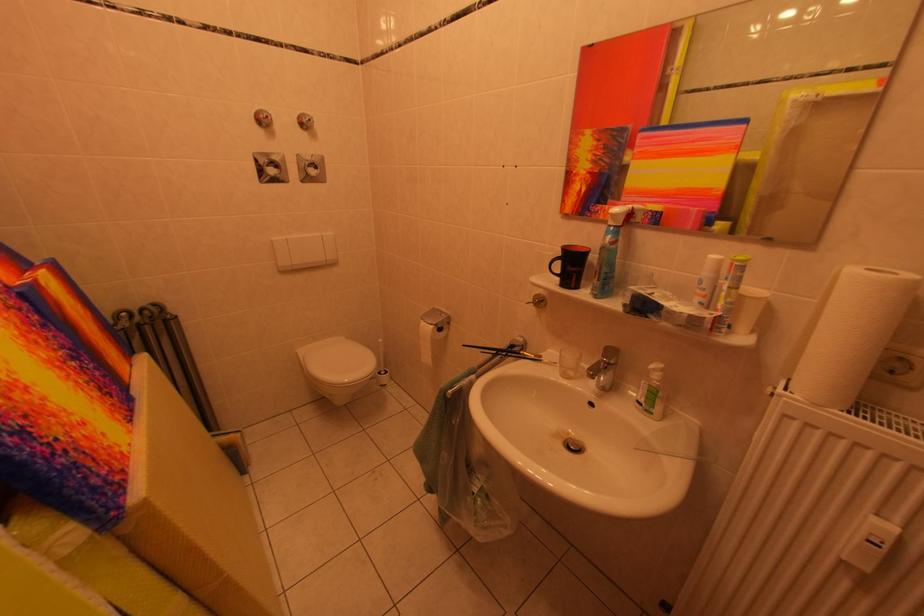
Where is `white radiator knob`? This screenshot has width=924, height=616. white radiator knob is located at coordinates (898, 578).